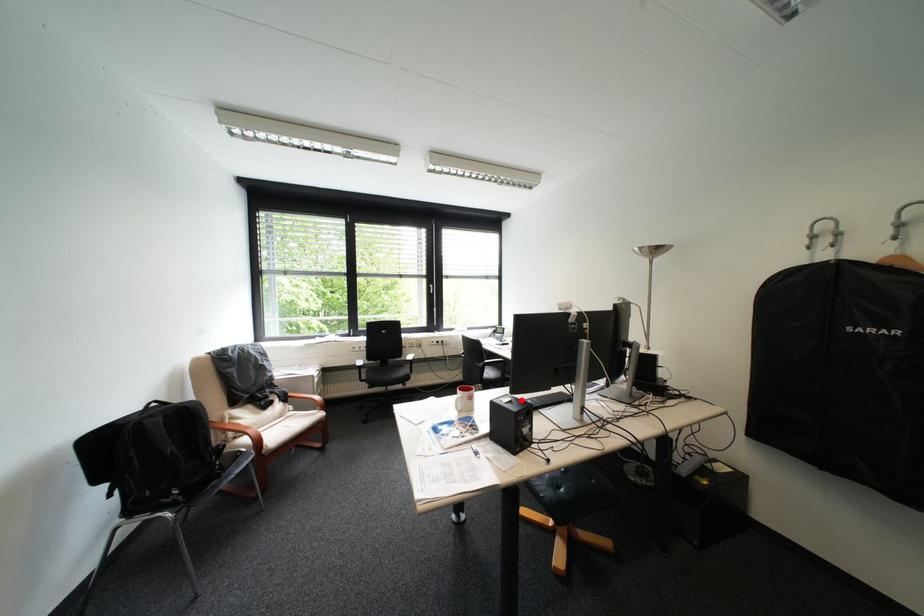
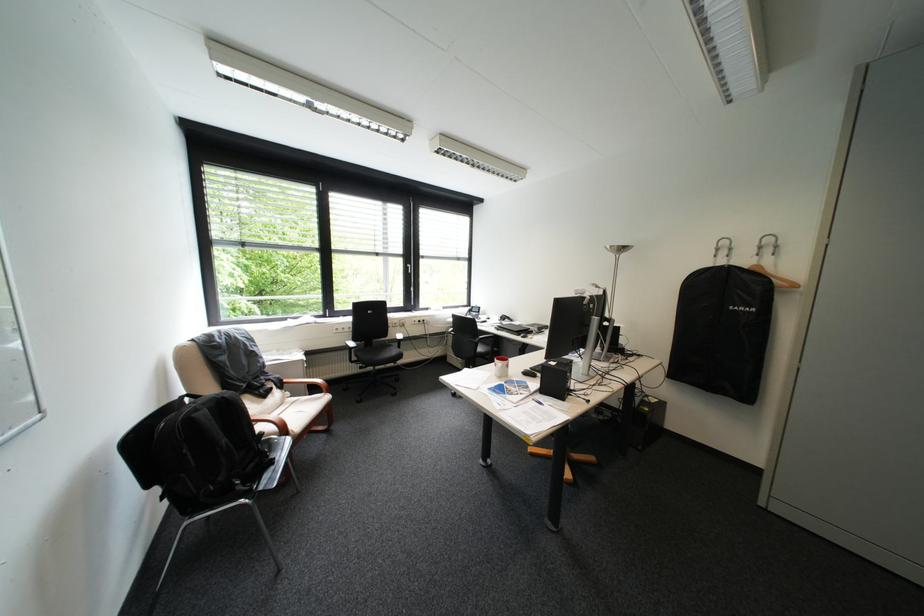
The point at the highlighted location is marked in the first image. Where is the corresponding point in the second image?

(568, 363)